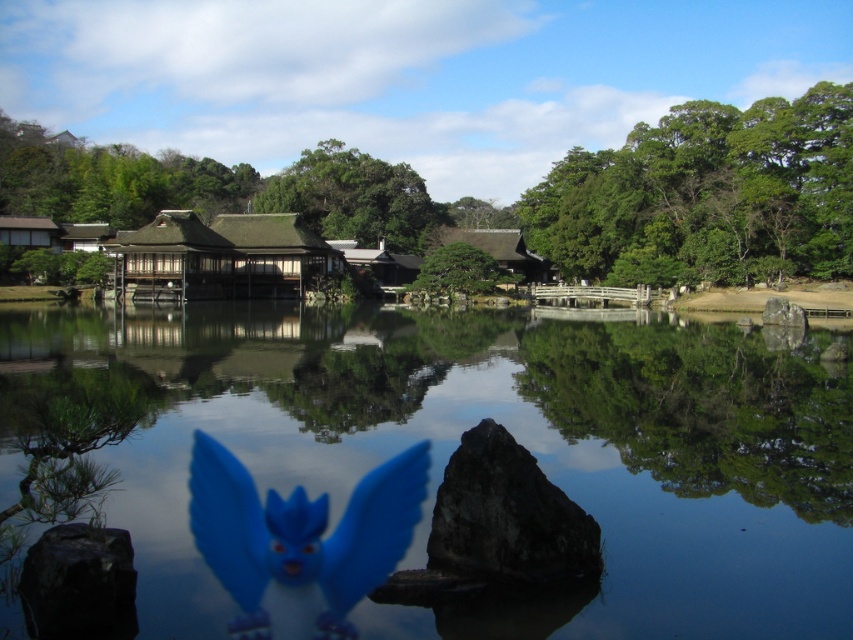
Based on the photo, you are a visitor in this Japanese garden and want to take a photo of the transparent water at center and the green leafy tree at upper right. Which object will appear closer to the camera in the photo?

The transparent water at center will appear closer to the camera in the photo because it is positioned in front of the green leafy tree at upper right.